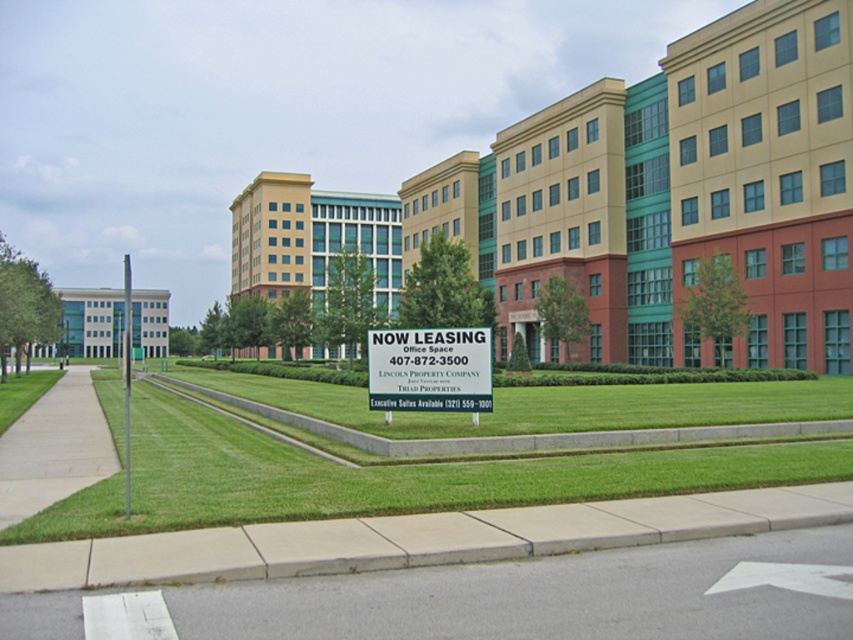
Question: Which point is closer to the camera?

Choices:
 (A) white plastic sign at center
 (B) gray asphalt at lower center

Answer: (B)

Question: Can you confirm if gray asphalt at lower center is smaller than white plastic sign at center?

Choices:
 (A) yes
 (B) no

Answer: (A)

Question: Can you confirm if gray asphalt at lower center is smaller than white plastic sign at center?

Choices:
 (A) no
 (B) yes

Answer: (B)

Question: Which object is closer to the camera taking this photo?

Choices:
 (A) white plastic sign at center
 (B) gray asphalt at lower center

Answer: (B)

Question: Is gray asphalt at lower center bigger than white plastic sign at center?

Choices:
 (A) no
 (B) yes

Answer: (A)